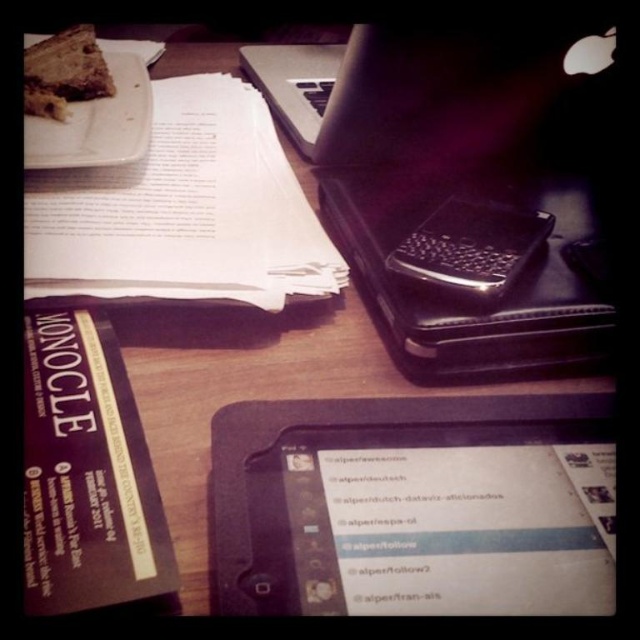
You are organizing a desk and see the white paper at upper left and the chocolate cake at upper left. Which item is located to the right of the other?

The white paper at upper left is positioned on the right side of chocolate cake at upper left, so the white paper at upper left is to the right of the chocolate cake at upper left.

What is the object located at the coordinates point (86, 474)?

The object at point (86, 474) is the matte black book at lower left.